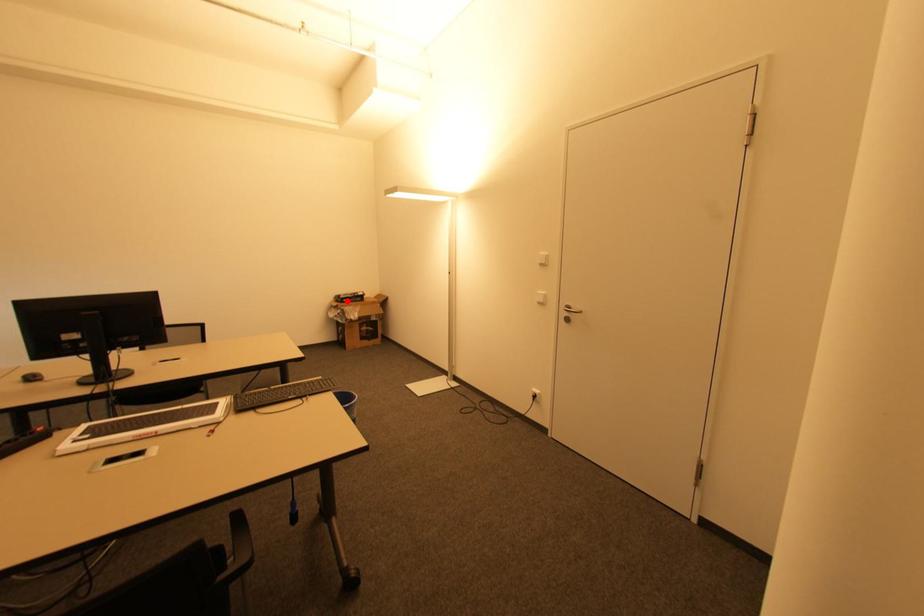
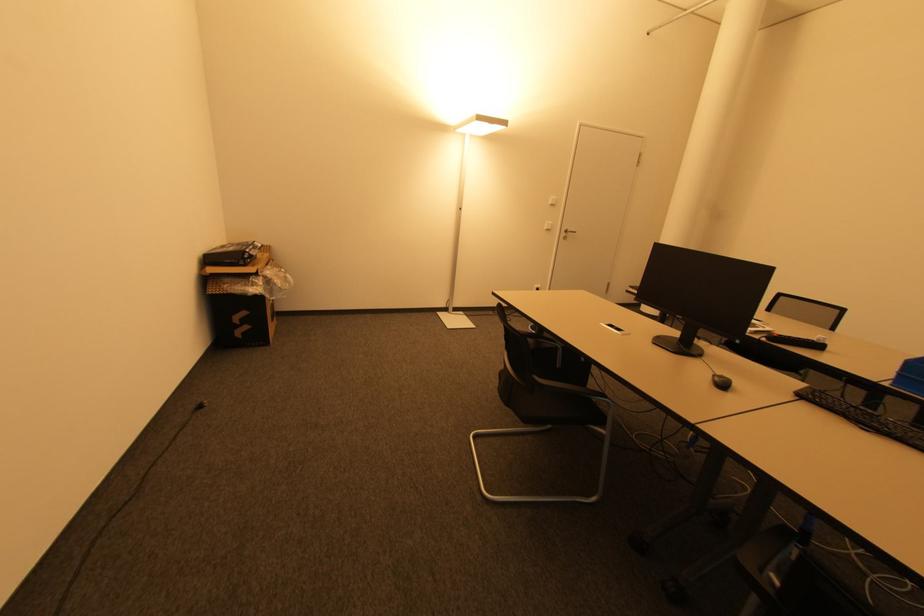
Locate, in the second image, the point that corresponds to the highlighted location in the first image.

(250, 261)